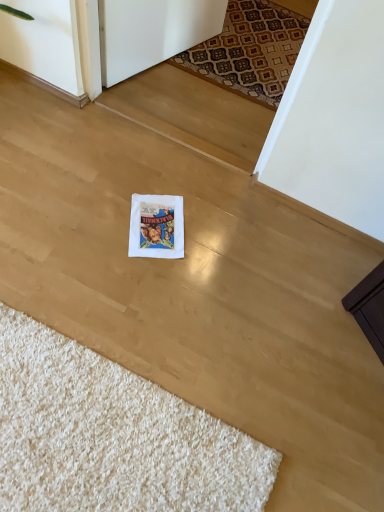
You are a GUI agent. You are given a task and a screenshot of the screen. Output one action in this format:
    pyautogui.click(x=<x>, y=<y>)
    Task: Click on the vacant space that's between white paper postcard at center and white shaggy rug at lower left
    The image size is (384, 512).
    Given the screenshot: What is the action you would take?
    pyautogui.click(x=155, y=312)